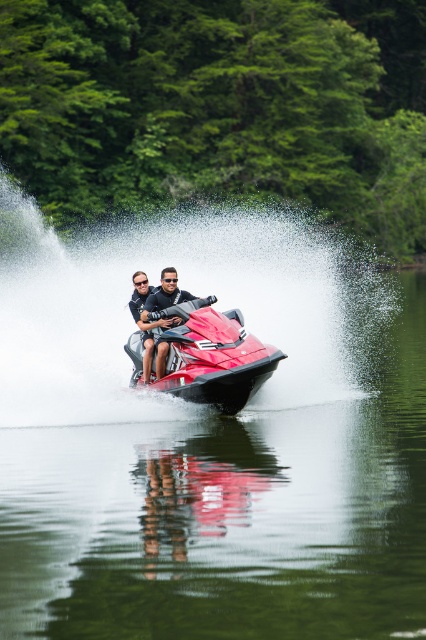
Does clear water at jet ski center appear over shiny metallic jet ski at center?

No.

Who is taller, clear water at jet ski center or shiny metallic jet ski at center?

Standing taller between the two is clear water at jet ski center.

Describe the element at coordinates (230, 512) in the screenshot. I see `clear water at jet ski center` at that location.

At what (x,y) coordinates should I click in order to perform the action: click on clear water at jet ski center. Please return your answer as a coordinate pair (x, y). Looking at the image, I should click on (230, 512).

Who is positioned more to the right, shiny red jet ski at center or shiny metallic jet ski at center?

shiny red jet ski at center

Is shiny red jet ski at center taller than shiny metallic jet ski at center?

Indeed, shiny red jet ski at center has a greater height compared to shiny metallic jet ski at center.

Image resolution: width=426 pixels, height=640 pixels. What do you see at coordinates (213, 356) in the screenshot? I see `shiny red jet ski at center` at bounding box center [213, 356].

Where is `shiny red jet ski at center`? shiny red jet ski at center is located at coordinates (213, 356).

Measure the distance between point (339, 593) and camera.

Point (339, 593) and camera are 14.50 meters apart.

Which is in front, point (342, 564) or point (201, 332)?

Point (342, 564) is in front.

Is point (253, 492) positioned after point (276, 348)?

No, (253, 492) is closer to viewer.

Image resolution: width=426 pixels, height=640 pixels. Identify the location of clear water at jet ski center. (230, 512).